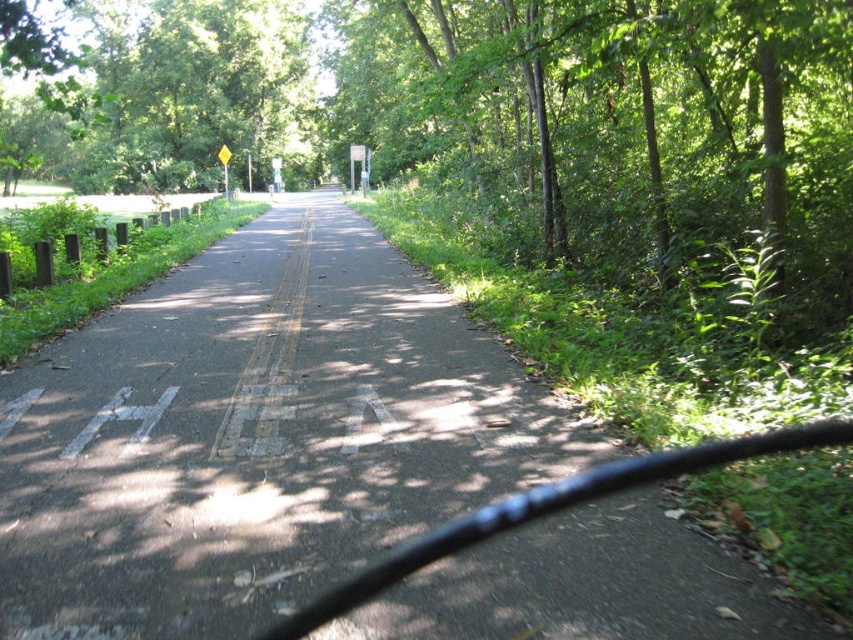
Is the position of green leafy tree at upper left less distant than that of yellow plastic sign at center?

Yes, it is in front of yellow plastic sign at center.

Identify the location of green leafy tree at upper left. This screenshot has height=640, width=853. [x=154, y=90].

The width and height of the screenshot is (853, 640). I want to click on green leafy tree at upper left, so click(154, 90).

Does black asphalt road at center appear on the left side of green leafy tree at center?

In fact, black asphalt road at center is to the right of green leafy tree at center.

The width and height of the screenshot is (853, 640). What are the coordinates of `black asphalt road at center` in the screenshot? It's located at (256, 435).

Who is lower down, green leafy tree at center or green leafy tree at upper left?

green leafy tree at center

Consider the image. Is green leafy tree at center positioned before green leafy tree at upper left?

That is True.

Identify the location of green leafy tree at center. The height and width of the screenshot is (640, 853). (489, 116).

This screenshot has height=640, width=853. I want to click on green leafy tree at center, so click(x=489, y=116).